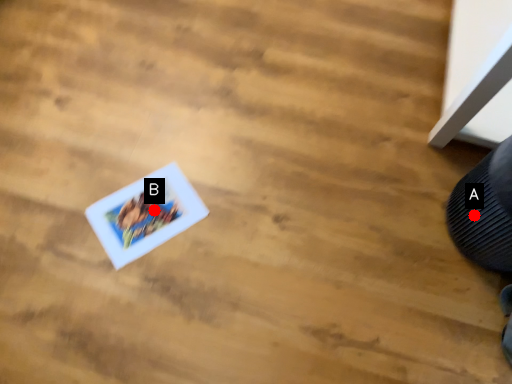
Question: Two points are circled on the image, labeled by A and B beside each circle. Which of the following is the closest to the observer?

Choices:
 (A) A is closer
 (B) B is closer

Answer: (A)